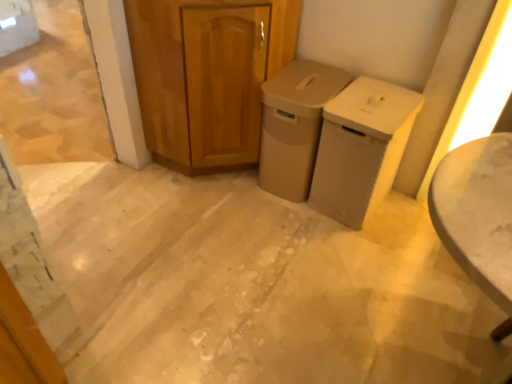
Locate an element on the screen. vacant space to the right of beige textured waste bin at center-right, positioned as the first waste container in right-to-left order is located at coordinates (405, 214).